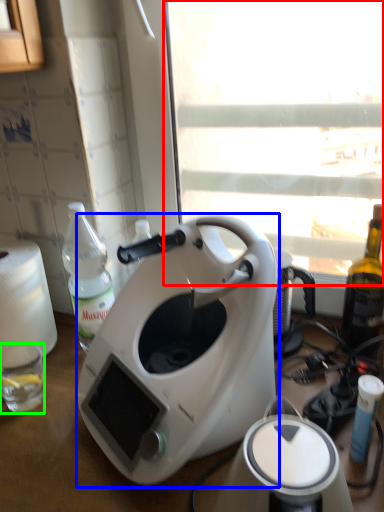
Question: Considering the real-world distances, which object is farthest from window screen (highlighted by a red box)? coffee maker (highlighted by a blue box) or coffee cup (highlighted by a green box)?

Choices:
 (A) coffee maker
 (B) coffee cup

Answer: (B)